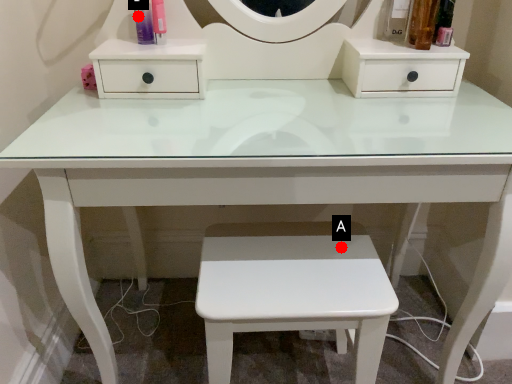
Question: Two points are circled on the image, labeled by A and B beside each circle. Which of the following is the closest to the observer?

Choices:
 (A) A is closer
 (B) B is closer

Answer: (A)